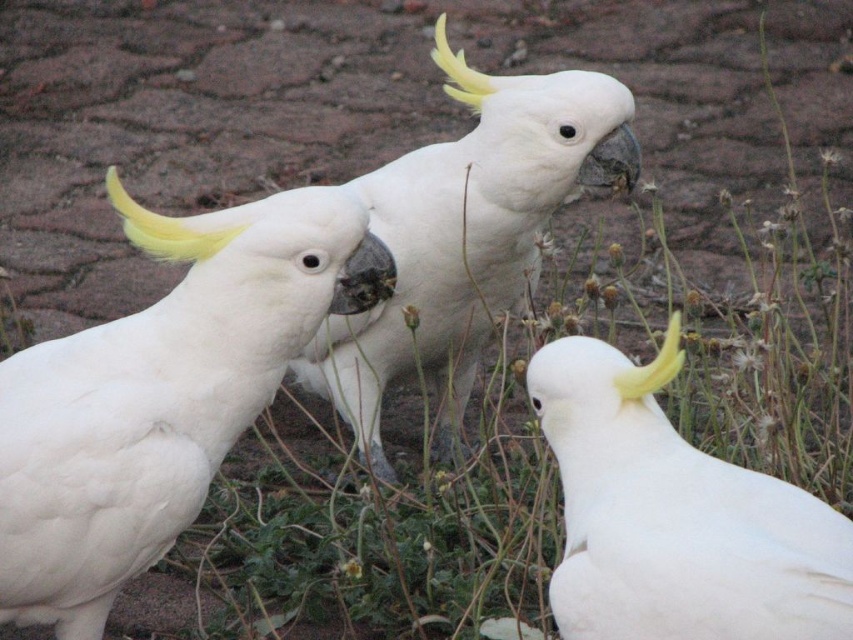
Which is more to the left, white feathered parrot at left or white feathered parrot at lower right?

Positioned to the left is white feathered parrot at left.

Is white feathered parrot at left in front of white feathered parrot at lower right?

No.

Is point (318, 221) farther from viewer compared to point (605, 368)?

Yes, it is behind point (605, 368).

The width and height of the screenshot is (853, 640). Find the location of `white feathered parrot at left`. white feathered parrot at left is located at coordinates (161, 396).

Is white feathered parrot at left wider than white feathered parrot at center?

Incorrect, white feathered parrot at left's width does not surpass white feathered parrot at center's.

Is white feathered parrot at left taller than white feathered parrot at center?

In fact, white feathered parrot at left may be shorter than white feathered parrot at center.

Between point (90, 540) and point (434, 157), which one is positioned in front?

Positioned in front is point (90, 540).

Identify the location of white feathered parrot at left. (161, 396).

Where is `white feathered parrot at center`? Image resolution: width=853 pixels, height=640 pixels. white feathered parrot at center is located at coordinates (467, 234).

Looking at this image, between white feathered parrot at center and white feathered parrot at lower right, which one is positioned higher?

Positioned higher is white feathered parrot at center.

You are a GUI agent. You are given a task and a screenshot of the screen. Output one action in this format:
    pyautogui.click(x=<x>, y=<y>)
    Task: Click on the white feathered parrot at center
    The width and height of the screenshot is (853, 640).
    Given the screenshot: What is the action you would take?
    pyautogui.click(x=467, y=234)